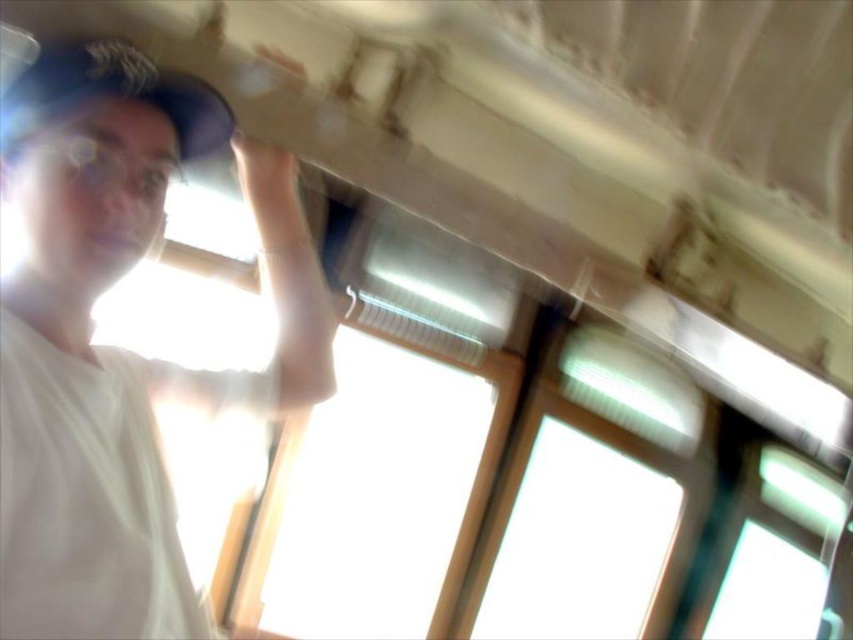
Which of these two, white matte t-shirt at upper left or matte skin hand at upper center, stands shorter?

With less height is matte skin hand at upper center.

Does point (132, 440) lie behind point (242, 163)?

No, (132, 440) is closer to viewer.

At what (x,y) coordinates should I click in order to perform the action: click on white matte t-shirt at upper left. Please return your answer as a coordinate pair (x, y). This screenshot has height=640, width=853. Looking at the image, I should click on (115, 348).

Is white matte t-shirt at upper left smaller than white fabric baseball hat at upper left?

Actually, white matte t-shirt at upper left might be larger than white fabric baseball hat at upper left.

Image resolution: width=853 pixels, height=640 pixels. I want to click on white matte t-shirt at upper left, so click(115, 348).

Describe the element at coordinates (113, 93) in the screenshot. This screenshot has width=853, height=640. I see `white fabric baseball hat at upper left` at that location.

Between white fabric baseball hat at upper left and matte skin hand at upper center, which one is positioned higher?

white fabric baseball hat at upper left is above.

Who is more distant from viewer, (120,88) or (231,150)?

Point (231,150)

At what (x,y) coordinates should I click in order to perform the action: click on white fabric baseball hat at upper left. Please return your answer as a coordinate pair (x, y). Looking at the image, I should click on coord(113,93).